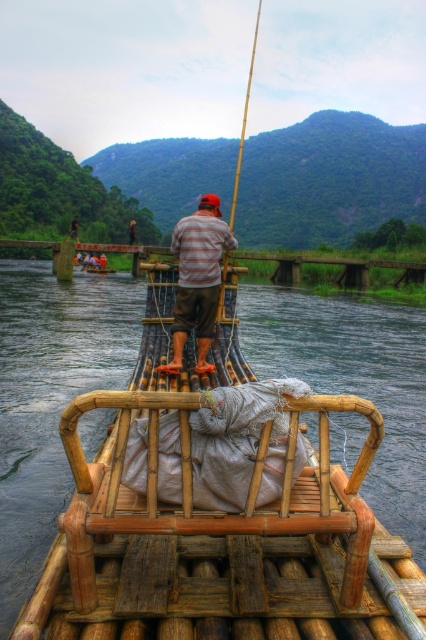
Question: Which point is farther to the camera?

Choices:
 (A) (198, 356)
 (B) (49, 385)

Answer: (B)

Question: Which object appears closest to the camera in this image?

Choices:
 (A) brown wooden raft at center
 (B) striped fabric shirt at center

Answer: (A)

Question: Is brown wooden raft at center thinner than striped fabric shirt at center?

Choices:
 (A) no
 (B) yes

Answer: (A)

Question: Can you confirm if brown wooden raft at center is positioned below striped fabric shirt at center?

Choices:
 (A) no
 (B) yes

Answer: (B)

Question: Is brown wooden raft at center above striped fabric shirt at center?

Choices:
 (A) yes
 (B) no

Answer: (B)

Question: Which object is closer to the camera taking this photo?

Choices:
 (A) striped fabric shirt at center
 (B) brown wooden raft at center

Answer: (B)